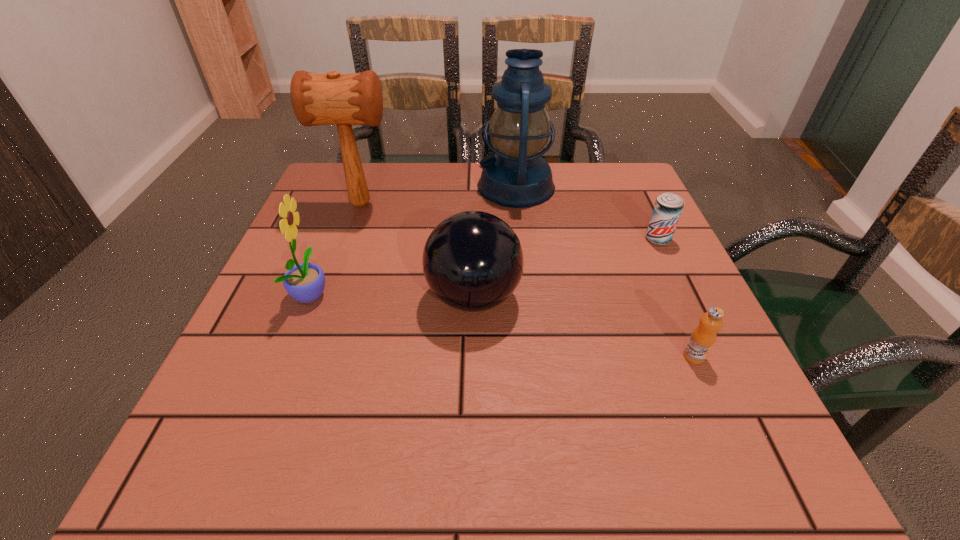
Image resolution: width=960 pixels, height=540 pixels. Find the location of `free space that satisfies the following two spatial constraints: 1. on the face of the third farthest object; 2. on the right side of the lantern`. free space that satisfies the following two spatial constraints: 1. on the face of the third farthest object; 2. on the right side of the lantern is located at coordinates (522, 239).